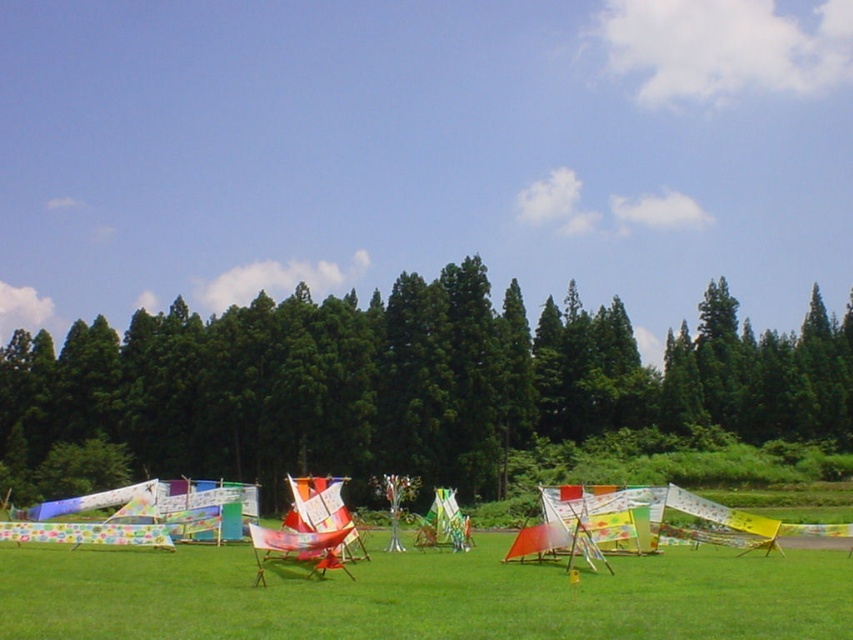
Is green leafy tree at center to the left of green grassy at center from the viewer's perspective?

No, green leafy tree at center is not to the left of green grassy at center.

Who is shorter, green leafy tree at center or green grassy at center?

Standing shorter between the two is green grassy at center.

Does point (537, 384) lie in front of point (370, 627)?

No, it is behind (370, 627).

You are a GUI agent. You are given a task and a screenshot of the screen. Output one action in this format:
    pyautogui.click(x=<x>, y=<y>)
    Task: Click on the green leafy tree at center
    Image resolution: width=853 pixels, height=640 pixels.
    Given the screenshot: What is the action you would take?
    pyautogui.click(x=409, y=384)